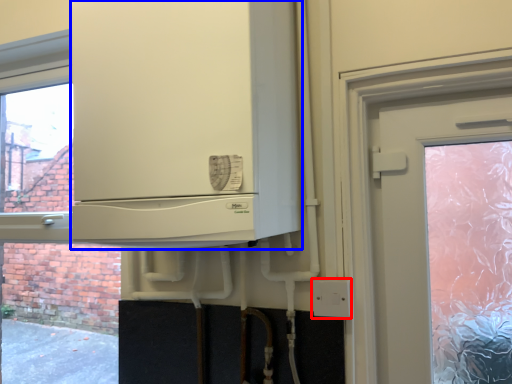
Question: Which of the following is the farthest to the observer, electric outlet (highlighted by a red box) or cabinetry (highlighted by a blue box)?

Choices:
 (A) electric outlet
 (B) cabinetry

Answer: (A)